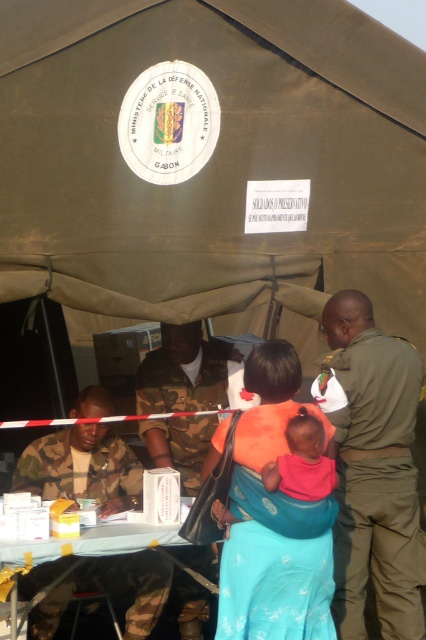
Question: Among these points, which one is farthest from the camera?

Choices:
 (A) (299, 460)
 (B) (201, 387)

Answer: (B)

Question: Does green uniform at right appear on the right side of camo uniform at center?

Choices:
 (A) no
 (B) yes

Answer: (B)

Question: Is camo uniform at left behind camo uniform at center?

Choices:
 (A) yes
 (B) no

Answer: (B)

Question: Does orange fabric baby carrier at center have a smaller size compared to pink fabric baby at center?

Choices:
 (A) no
 (B) yes

Answer: (A)

Question: Estimate the real-world distances between objects in this image. Which object is farther from the green uniform at right?

Choices:
 (A) orange fabric baby carrier at center
 (B) camo uniform at left
 (C) camo uniform at center
 (D) pink fabric baby at center

Answer: (B)

Question: Estimate the real-world distances between objects in this image. Which object is farther from the green uniform at right?

Choices:
 (A) camo uniform at left
 (B) camo uniform at center

Answer: (A)